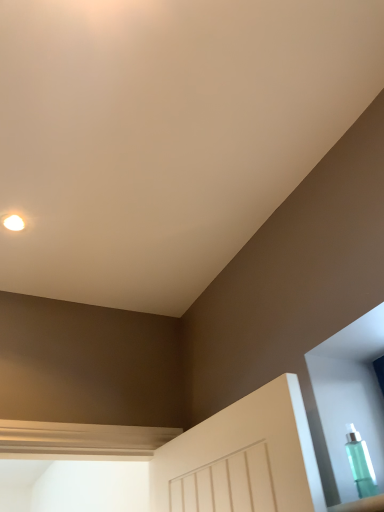
Question: Is transparent plastic bottle at lower right facing towards matte white droplight at upper left?

Choices:
 (A) no
 (B) yes

Answer: (A)

Question: Is transparent plastic bottle at lower right taller than matte white droplight at upper left?

Choices:
 (A) no
 (B) yes

Answer: (B)

Question: Could matte white droplight at upper left be considered to be inside transparent plastic bottle at lower right?

Choices:
 (A) no
 (B) yes

Answer: (A)

Question: Is transparent plastic bottle at lower right closer to the viewer compared to matte white droplight at upper left?

Choices:
 (A) yes
 (B) no

Answer: (A)

Question: From a real-world perspective, is transparent plastic bottle at lower right beneath matte white droplight at upper left?

Choices:
 (A) yes
 (B) no

Answer: (A)

Question: Does transparent plastic bottle at lower right have a greater width compared to matte white droplight at upper left?

Choices:
 (A) no
 (B) yes

Answer: (A)

Question: Could you tell me if matte white droplight at upper left is facing transparent plastic bottle at lower right?

Choices:
 (A) no
 (B) yes

Answer: (A)

Question: Does matte white droplight at upper left have a lesser height compared to transparent plastic bottle at lower right?

Choices:
 (A) no
 (B) yes

Answer: (B)

Question: Is matte white droplight at upper left thinner than transparent plastic bottle at lower right?

Choices:
 (A) yes
 (B) no

Answer: (B)

Question: From the image's perspective, is matte white droplight at upper left below transparent plastic bottle at lower right?

Choices:
 (A) yes
 (B) no

Answer: (B)

Question: Can you confirm if matte white droplight at upper left is taller than transparent plastic bottle at lower right?

Choices:
 (A) yes
 (B) no

Answer: (B)

Question: Is transparent plastic bottle at lower right located within matte white droplight at upper left?

Choices:
 (A) yes
 (B) no

Answer: (B)

Question: Is matte white droplight at upper left to the left or to the right of transparent plastic bottle at lower right in the image?

Choices:
 (A) right
 (B) left

Answer: (B)